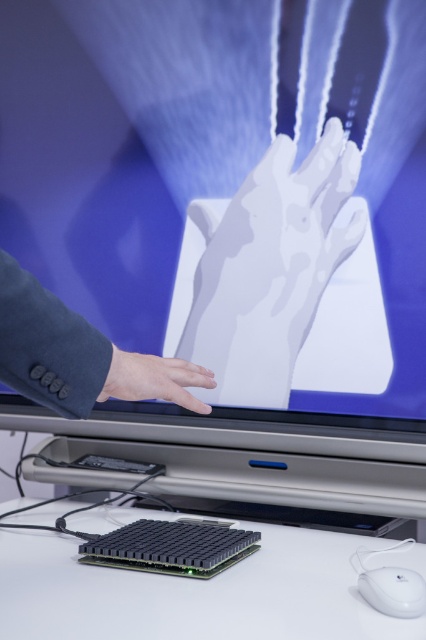
Does white plastic table at lower center have a lesser width compared to smooth skin hand at lower left?

In fact, white plastic table at lower center might be wider than smooth skin hand at lower left.

Can you confirm if white plastic table at lower center is positioned below smooth skin hand at lower left?

Yes.

Between point (296, 628) and point (160, 364), which one is positioned behind?

Positioned behind is point (160, 364).

The image size is (426, 640). I want to click on white plastic table at lower center, so click(193, 593).

Which is more to the left, white matte hand at center or smooth skin hand at lower left?

Positioned to the left is smooth skin hand at lower left.

Is point (278, 156) positioned before point (137, 364)?

That is False.

Which is behind, point (186, 355) or point (210, 381)?

Point (186, 355)

I want to click on white matte hand at center, so click(268, 268).

Identify the location of white matte hand at center. The width and height of the screenshot is (426, 640). (268, 268).

Between point (215, 276) and point (422, 608), which one is positioned behind?

The point (215, 276) is more distant.

Does point (222, 372) lie behind point (379, 604)?

Yes, point (222, 372) is farther from viewer.

Identify the location of white matte hand at center. (268, 268).